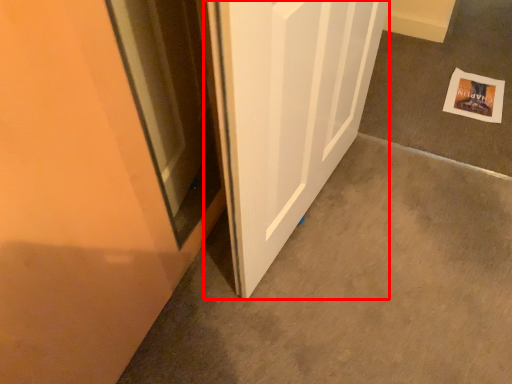
Question: From the image's perspective, what is the correct spatial positioning of door (annotated by the red box) in reference to postcard?

Choices:
 (A) above
 (B) below

Answer: (B)